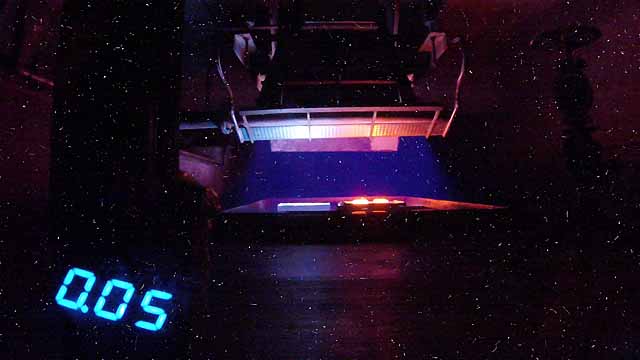
This screenshot has width=640, height=360. Identify the location of lights. (356, 196), (380, 201).